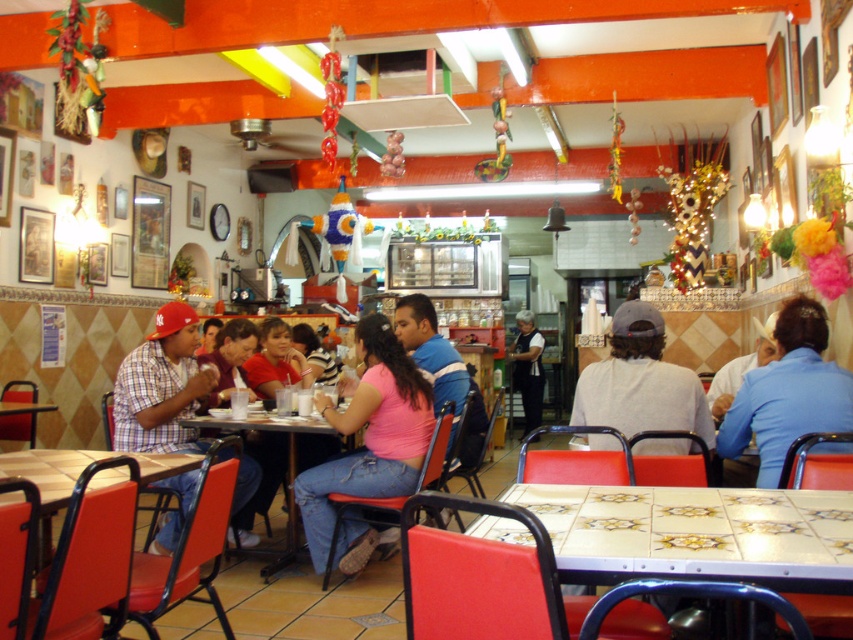
You are a customer in this restaurant and you see the white matte shirt at center. Can you estimate its exact location in the image using coordinates?

The white matte shirt at center is located at coordinates point (640,381).

You are a customer in the restaurant and want to order a drink. You see a pink matte shirt at center and a plaid cotton shirt at left. Which shirt is closer to the right side of the restaurant?

The pink matte shirt at center is positioned on the right side of the plaid cotton shirt at left, so it is closer to the right side of the restaurant.